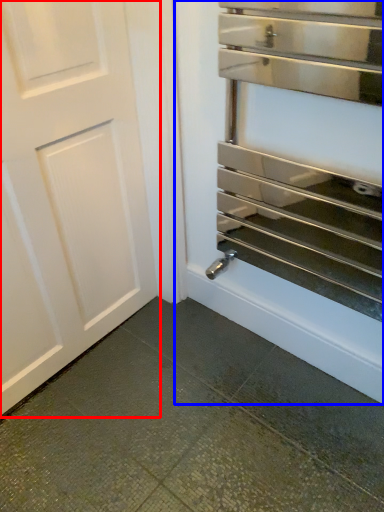
Question: Which object is closer to the camera taking this photo, door (highlighted by a red box) or oven (highlighted by a blue box)?

Choices:
 (A) door
 (B) oven

Answer: (B)